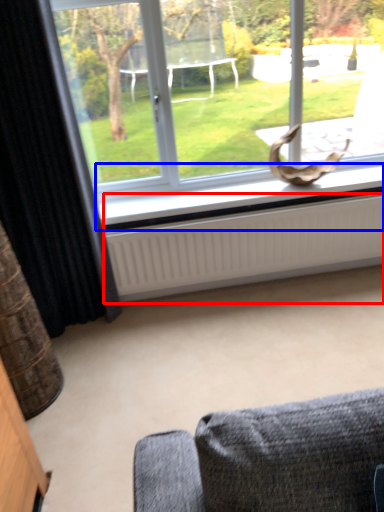
Question: Which of the following is the closest to the observer, radiator (highlighted by a red box) or window sill (highlighted by a blue box)?

Choices:
 (A) radiator
 (B) window sill

Answer: (A)